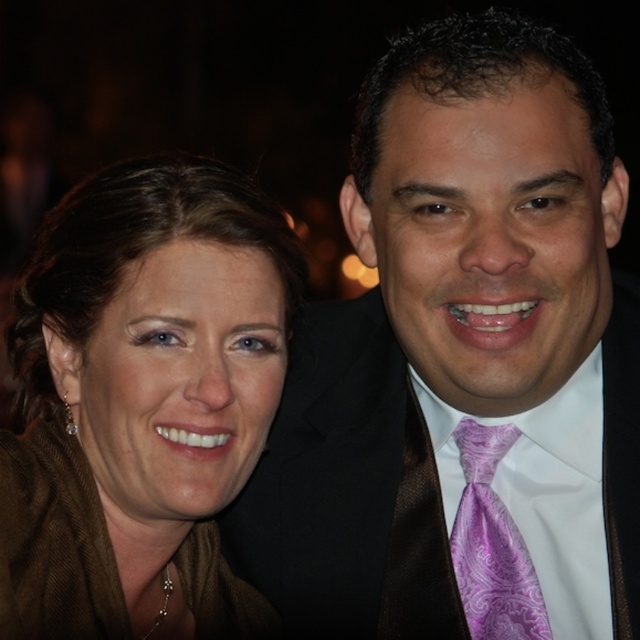
Which of these two, brown fabric at left or purple satin dress shirt at center, stands taller?

brown fabric at left

Is point (240, 216) in front of point (584, 451)?

Yes, it is.

You are a GUI agent. You are given a task and a screenshot of the screen. Output one action in this format:
    pyautogui.click(x=<x>, y=<y>)
    Task: Click on the brown fabric at left
    The height and width of the screenshot is (640, 640).
    Given the screenshot: What is the action you would take?
    pyautogui.click(x=140, y=390)

Does purple satin dress shirt at center appear over purple paisley silk tie at right?

Correct, purple satin dress shirt at center is located above purple paisley silk tie at right.

Where is `purple satin dress shirt at center`? The width and height of the screenshot is (640, 640). purple satin dress shirt at center is located at coordinates (545, 492).

The image size is (640, 640). What are the coordinates of `purple satin dress shirt at center` in the screenshot? It's located at (545, 492).

Between brown fabric at left and purple paisley silk tie at right, which one is positioned lower?

Positioned lower is purple paisley silk tie at right.

Does brown fabric at left appear on the right side of purple paisley silk tie at right?

In fact, brown fabric at left is to the left of purple paisley silk tie at right.

The width and height of the screenshot is (640, 640). Describe the element at coordinates (140, 390) in the screenshot. I see `brown fabric at left` at that location.

The height and width of the screenshot is (640, 640). Identify the location of brown fabric at left. (140, 390).